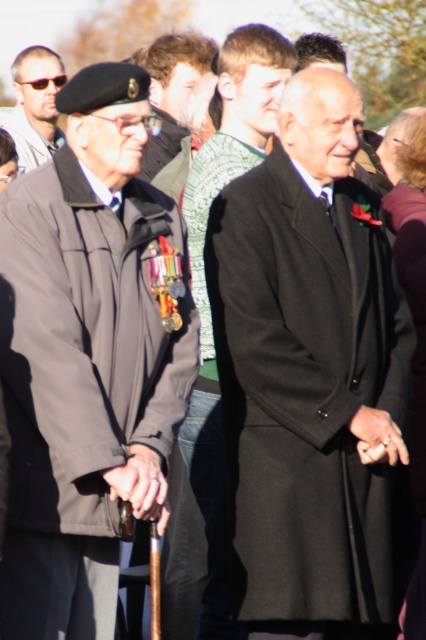
Which is above, black wool coat at center or dark gray wool coat at center?

Positioned higher is dark gray wool coat at center.

Does point (270, 477) come farther from viewer compared to point (204, 385)?

No, (270, 477) is closer to viewer.

Which is in front, point (324, 410) or point (270, 61)?

Positioned in front is point (324, 410).

Where is `black wool coat at center`? This screenshot has width=426, height=640. black wool coat at center is located at coordinates (310, 372).

Is point (48, 316) less distant than point (57, 68)?

Yes, point (48, 316) is closer to viewer.

Which is behind, point (5, 218) or point (42, 84)?

Positioned behind is point (42, 84).

Find the location of `matte black jacket at left`. matte black jacket at left is located at coordinates (89, 356).

Measure the distance between point (166, 44) and camera.

Point (166, 44) and camera are 19.09 meters apart from each other.

Identify the location of matte black beret at center. The height and width of the screenshot is (640, 426). (175, 90).

Does point (166, 188) come farther from viewer compared to point (39, 49)?

No, it is in front of (39, 49).

You are a GUI agent. You are given a task and a screenshot of the screen. Output one action in this format:
    pyautogui.click(x=<x>, y=<y>)
    Task: Click on the matte black beret at center
    The image size is (426, 640).
    Given the screenshot: What is the action you would take?
    pyautogui.click(x=175, y=90)